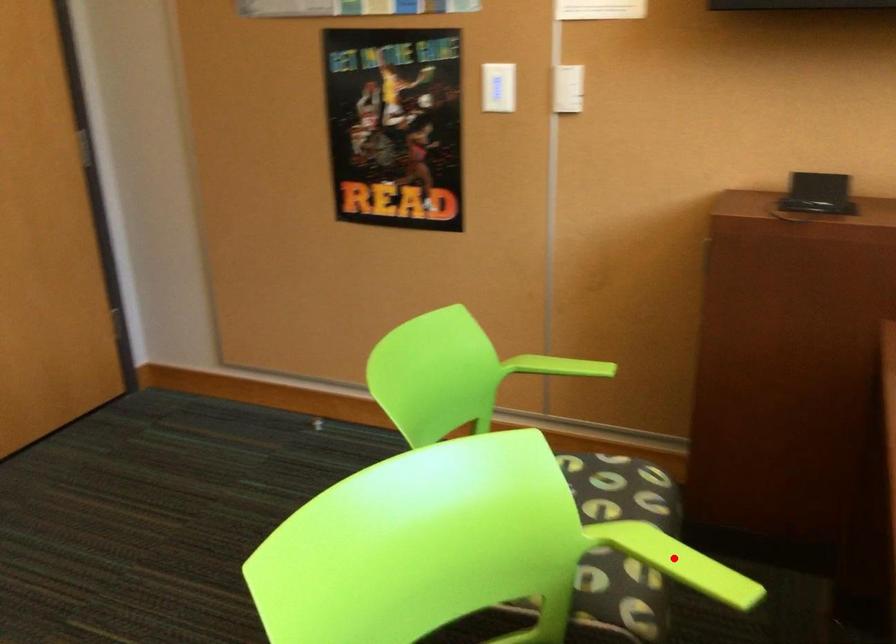
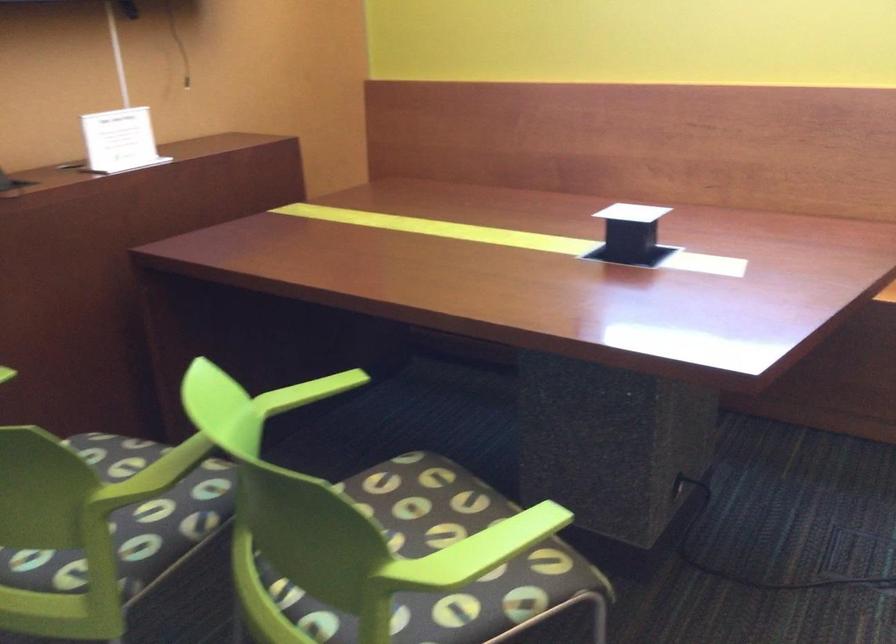
The point at the highlighted location is marked in the first image. Where is the corresponding point in the second image?

(307, 392)